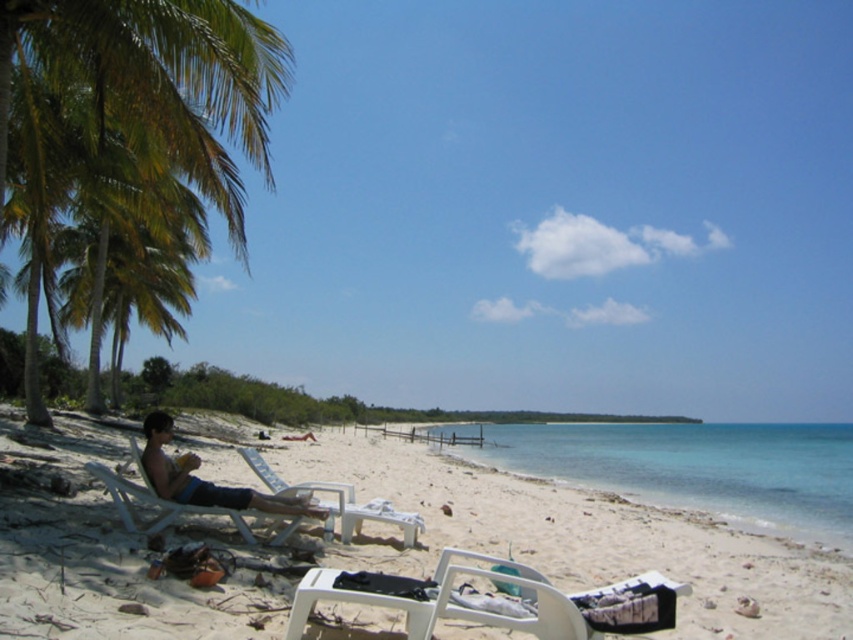
Between point (566, 440) and point (257, 504), which one is positioned in front?

Point (257, 504) is more forward.

Can you confirm if clear blue water at lower center is bigger than matte black lounge chair at lower left?

Correct, clear blue water at lower center is larger in size than matte black lounge chair at lower left.

Image resolution: width=853 pixels, height=640 pixels. I want to click on clear blue water at lower center, so (x=692, y=467).

I want to click on clear blue water at lower center, so click(692, 467).

Which is above, green leafy palm tree at left or white plastic beach chair at lower center?

green leafy palm tree at left is above.

Between point (225, 17) and point (587, 595), which one is positioned behind?

Point (225, 17)

You are a GUI agent. You are given a task and a screenshot of the screen. Output one action in this format:
    pyautogui.click(x=<x>, y=<y>)
    Task: Click on the green leafy palm tree at left
    This screenshot has height=640, width=853.
    Given the screenshot: What is the action you would take?
    pyautogui.click(x=154, y=83)

Image resolution: width=853 pixels, height=640 pixels. What are the coordinates of `green leafy palm tree at left` in the screenshot? It's located at (154, 83).

In the scene shown: Does green leafy palm tree at left come behind matte black lounge chair at lower left?

Yes.

Does green leafy palm tree at left appear on the left side of matte black lounge chair at lower left?

Correct, you'll find green leafy palm tree at left to the left of matte black lounge chair at lower left.

In the scene shown: Who is more forward, (222, 163) or (186, 490)?

Point (186, 490) is in front.

Where is `green leafy palm tree at left`? The width and height of the screenshot is (853, 640). green leafy palm tree at left is located at coordinates (154, 83).